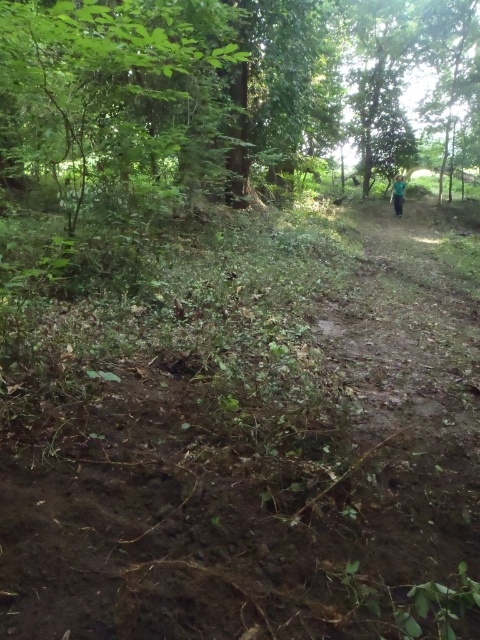
You are a hiker carrying a backpack and need to walk along the brown dirt track at center. Considering the width of the track and the presence of the green fabric person at upper right, do you think you can walk comfortably on the track without stepping into the surrounding vegetation?

The brown dirt track at center is wider than the green fabric person at upper right, so yes, you can walk comfortably on the track without needing to step into the surrounding vegetation.

You are a hiker planning to walk along the brown dirt track at center. You notice the green fabric person at upper right standing nearby. Considering their heights, which object would require more caution when stepping over?

The brown dirt track at center is shorter in height than the green fabric person at upper right. Since the track is lower, you might need to be cautious when stepping onto it from higher ground or navigating its uneven terrain, but the person is taller and might block your path.